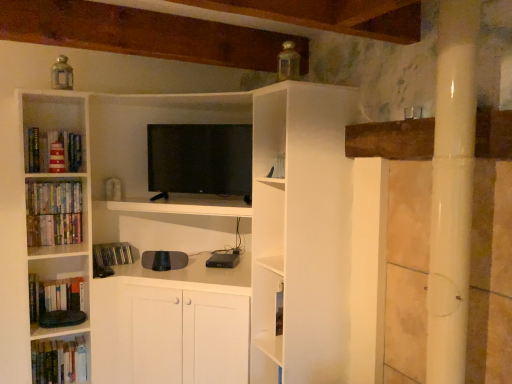
Locate an element on the screen. free space above hardcover books at left, the 3th book from the top (from a real-world perspective) is located at coordinates (51, 217).